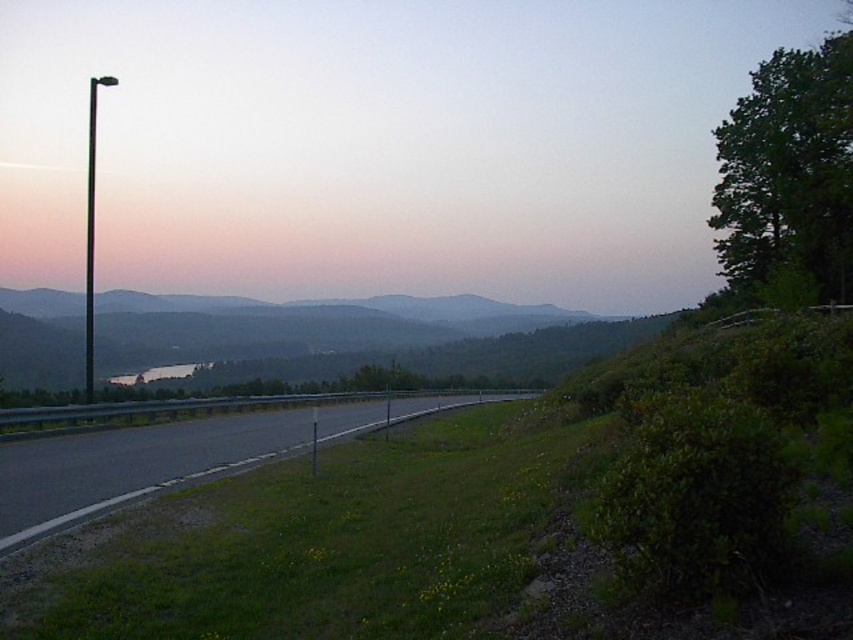
Question: Which object appears farthest from the camera in this image?

Choices:
 (A) asphalt road at center
 (B) matte black pole at left

Answer: (B)

Question: Does matte black pole at left lie in front of asphalt road at center?

Choices:
 (A) yes
 (B) no

Answer: (B)

Question: Which of the following is the closest to the observer?

Choices:
 (A) asphalt road at center
 (B) matte black pole at left

Answer: (A)

Question: Is matte black pole at left bigger than asphalt road at center?

Choices:
 (A) no
 (B) yes

Answer: (B)

Question: Which of the following is the closest to the observer?

Choices:
 (A) coord(184,246)
 (B) coord(7,509)

Answer: (B)

Question: Can you confirm if matte black pole at left is wider than asphalt road at center?

Choices:
 (A) no
 (B) yes

Answer: (B)